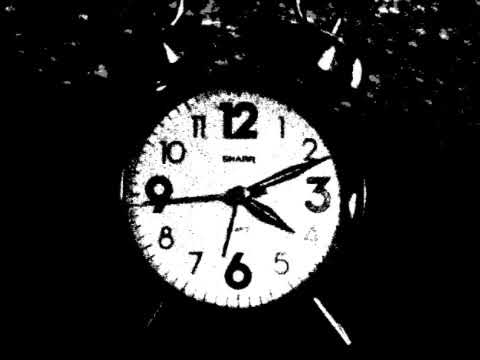
At what (x,y) coordinates should I click in order to perform the action: click on old fashion alarm clock. Please return your answer as a coordinate pair (x, y). This screenshot has height=360, width=480. Looking at the image, I should click on (312, 128), (236, 290), (191, 140), (314, 251).